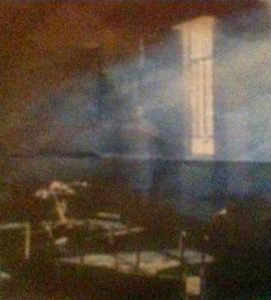
Locate an element on the screen. wood planks is located at coordinates (x=149, y=260), (x=102, y=220), (x=62, y=207), (x=89, y=255), (x=121, y=223).